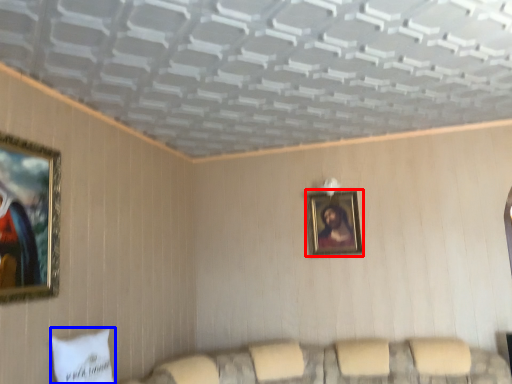
Question: Which of the following is the closest to the observer, picture frame (highlighted by a red box) or pillow (highlighted by a blue box)?

Choices:
 (A) picture frame
 (B) pillow

Answer: (B)